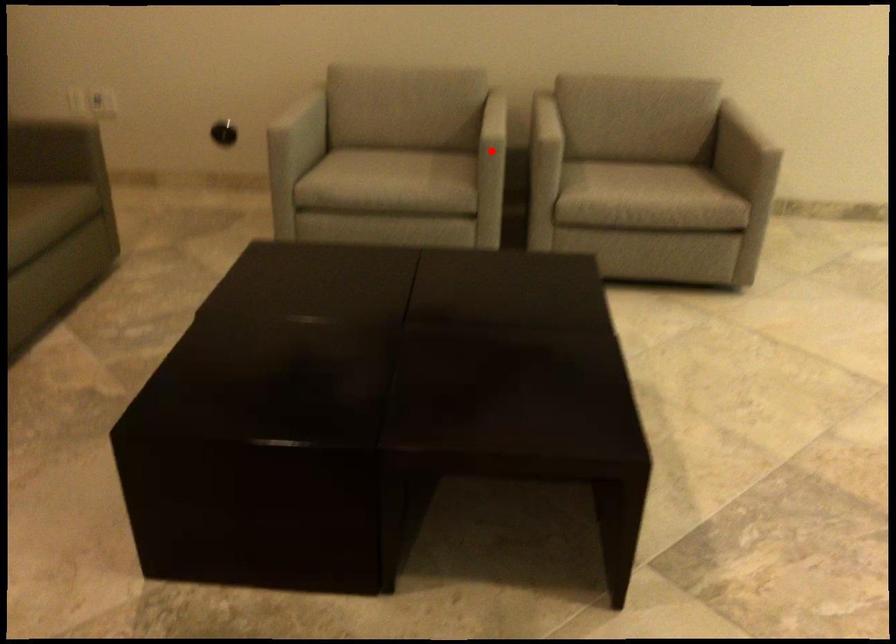
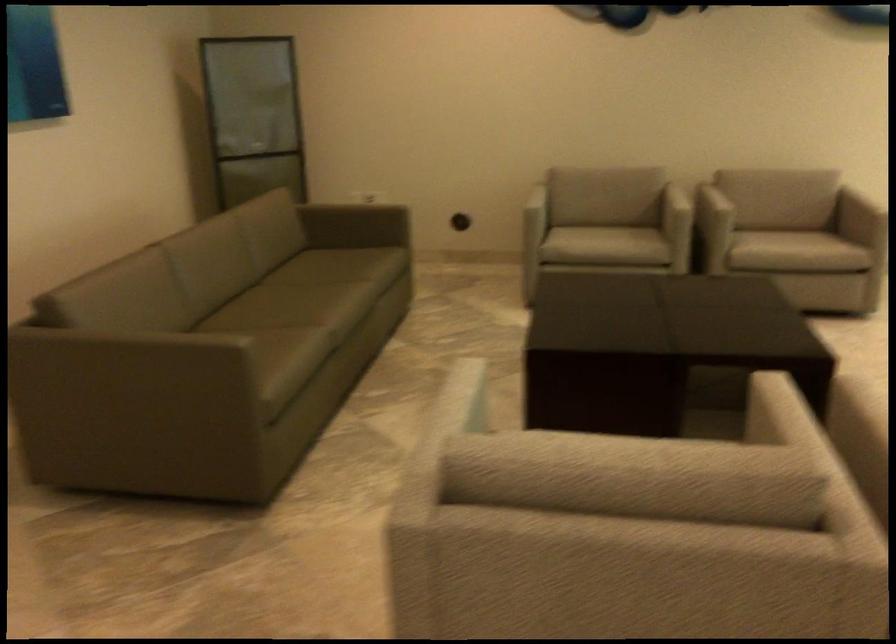
The point at the highlighted location is marked in the first image. Where is the corresponding point in the second image?

(681, 214)